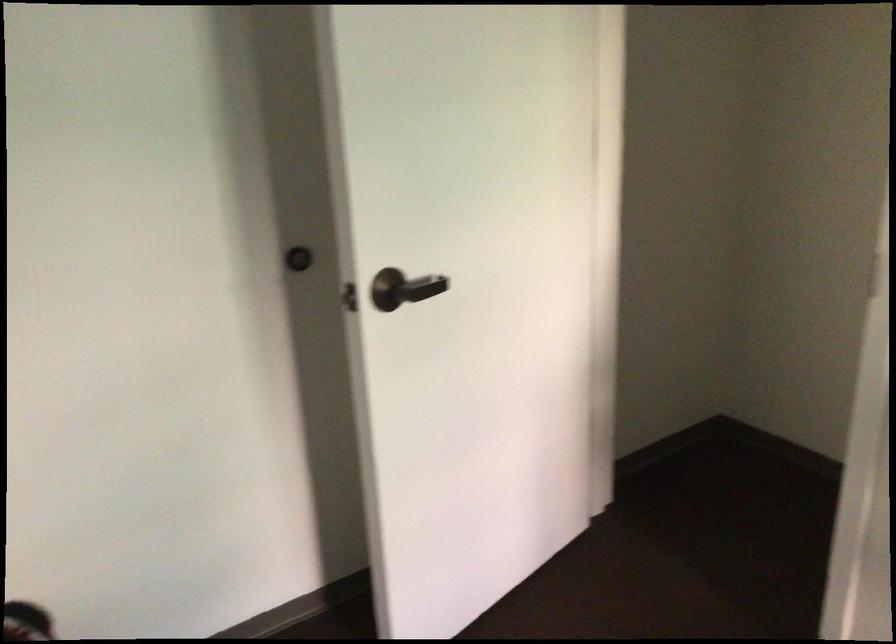
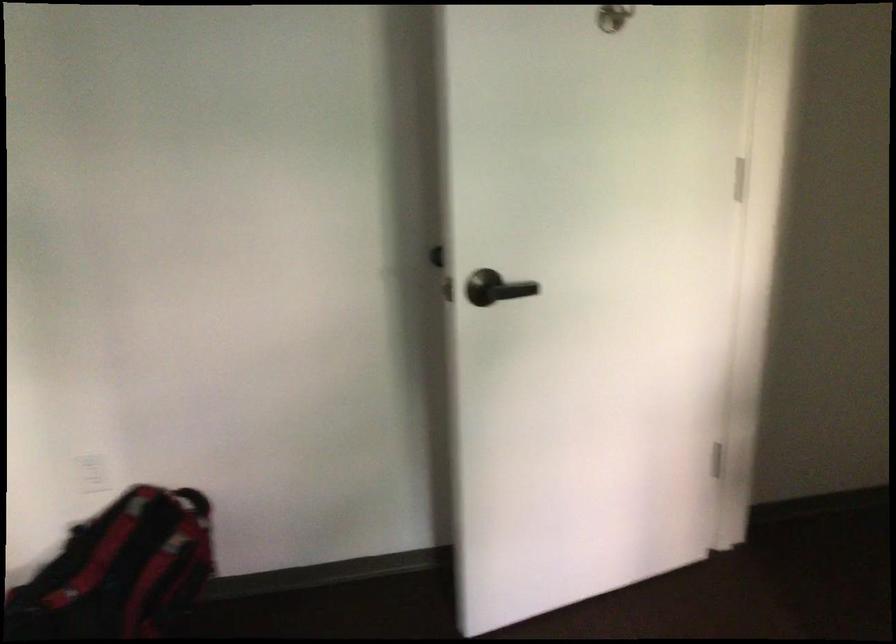
Question: In a continuous first-person perspective shot, in which direction is the camera moving?

Choices:
 (A) Left
 (B) Right
 (C) Forward
 (D) Backward

Answer: (B)